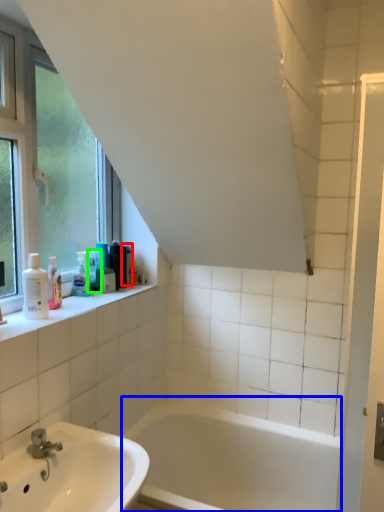
Question: Estimate the real-world distances between objects in this image. Which object is farther from toiletry (highlighted by a red box), bathtub (highlighted by a blue box) or toiletry (highlighted by a green box)?

Choices:
 (A) bathtub
 (B) toiletry

Answer: (A)